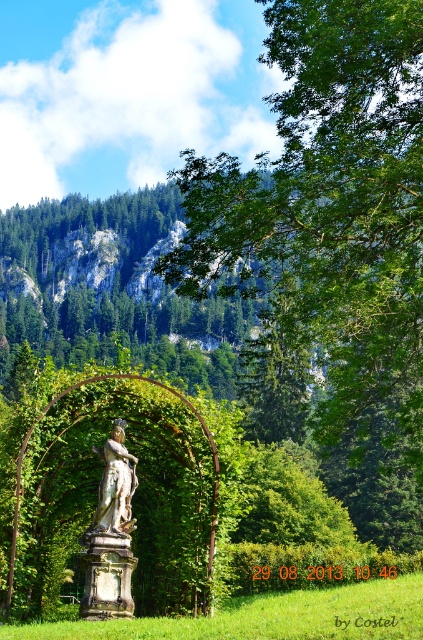
Can you confirm if bronze statue at center is bigger than white marble statue at center?

Correct, bronze statue at center is larger in size than white marble statue at center.

Which is behind, point (129, 552) or point (117, 493)?

Point (117, 493)

Identify the location of bronze statue at center. The image size is (423, 640). (110, 532).